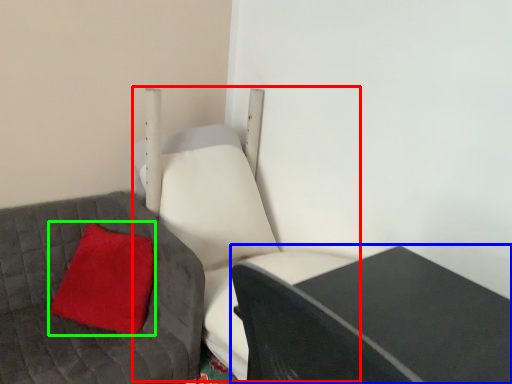
Question: Based on their relative distances, which object is nearer to swivel chair (highlighted by a red box)? Choose from table (highlighted by a blue box) and pillow (highlighted by a green box).

Choices:
 (A) table
 (B) pillow

Answer: (B)